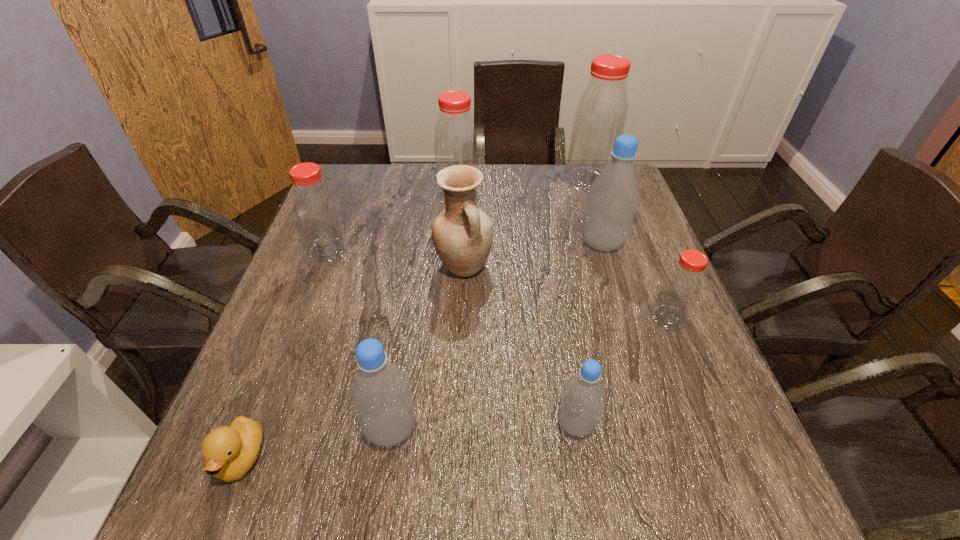
This screenshot has height=540, width=960. In order to click on the third nearest bottle in this screenshot , I will do `click(681, 288)`.

Identify the location of the fourth bottle from right to left. Image resolution: width=960 pixels, height=540 pixels. (583, 399).

Identify the location of the smallest gray bottle. The height and width of the screenshot is (540, 960). (583, 399).

What are the coordinates of `duckling` in the screenshot? It's located at pos(230,452).

Where is `vacant area situated 0.300m on the front of the tallest object`? The width and height of the screenshot is (960, 540). vacant area situated 0.300m on the front of the tallest object is located at coordinates (614, 259).

Locate an element on the screen. Image resolution: width=960 pixels, height=540 pixels. vacant area situated 0.210m on the right of the second red bottle from left to right is located at coordinates (549, 195).

The width and height of the screenshot is (960, 540). I want to click on blank space located on the left of the biggest gray bottle, so click(x=523, y=243).

Locate an element on the screen. free space located 0.070m on the left of the pottery is located at coordinates [407, 267].

The image size is (960, 540). Find the location of `vacant space positioned on the right of the third farthest red bottle`. vacant space positioned on the right of the third farthest red bottle is located at coordinates (494, 251).

This screenshot has width=960, height=540. In order to click on vacant area situated 0.210m on the right of the leftmost gray bottle in this screenshot , I will do `click(535, 428)`.